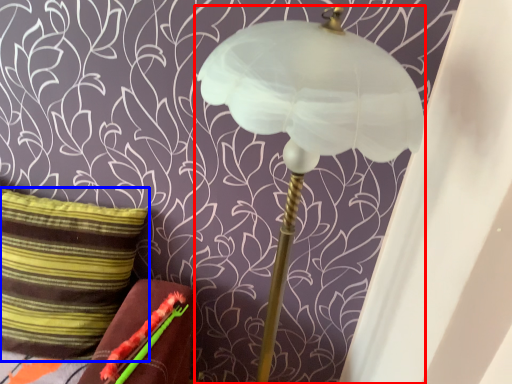
Question: Which object is further to the camera taking this photo, lamp (highlighted by a red box) or pillow (highlighted by a blue box)?

Choices:
 (A) lamp
 (B) pillow

Answer: (B)